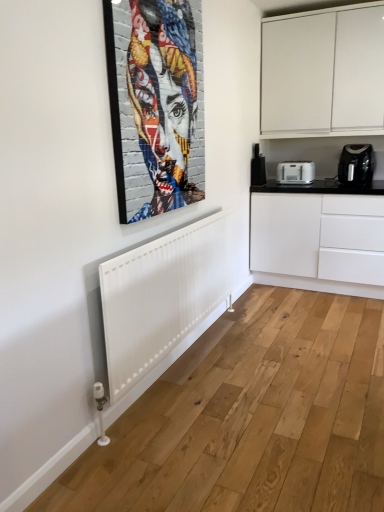
Question: Is black glossy countertop at right in front of or behind black plastic coffee machine at right in the image?

Choices:
 (A) front
 (B) behind

Answer: (A)

Question: From their relative heights in the image, would you say black glossy countertop at right is taller or shorter than black plastic coffee machine at right?

Choices:
 (A) tall
 (B) short

Answer: (A)

Question: Estimate the real-world distances between objects in this image. Which object is closer to the black glossy countertop at right?

Choices:
 (A) white matte cabinet at upper right
 (B) black plastic coffee maker at right, which is counted as the 1th home appliance, starting from the right
 (C) colorful mosaic portrait at upper center
 (D) black plastic coffee machine at right
 (E) white plastic toaster at center-right, which is the 2th home appliance from right to left

Answer: (B)

Question: Estimate the real-world distances between objects in this image. Which object is farther from the black plastic coffee machine at right?

Choices:
 (A) colorful mosaic portrait at upper center
 (B) white matte cabinet at upper right
 (C) black plastic coffee maker at right, which is counted as the 1th home appliance, starting from the right
 (D) white plastic toaster at center-right, which is the 2th home appliance from right to left
 (E) black glossy countertop at right

Answer: (A)